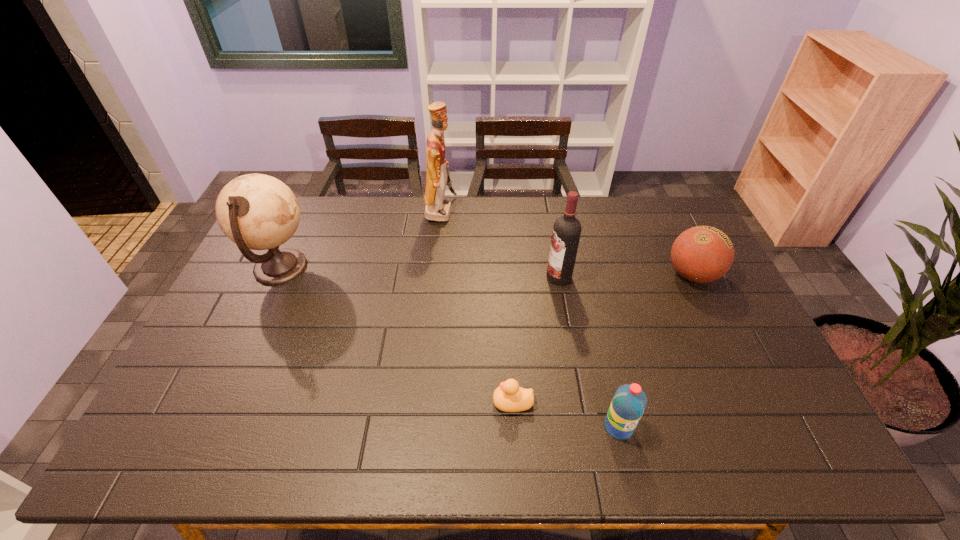
What are the coordinates of `vacant space that satisfies the following two spatial constraints: 1. on the front-facing side of the rightmost object; 2. on the left side of the farthest object` in the screenshot? It's located at (435, 275).